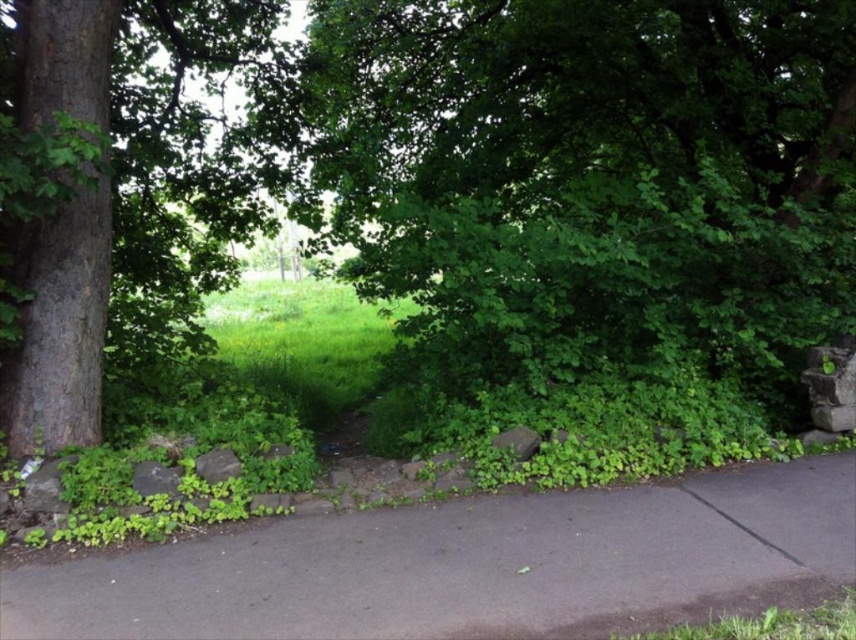
You are standing at point A, which is at coordinates point A at (547,253). You want to walk to point B, which is at coordinates point B at 0.602, 0.359. The path between them is 5.01 meters long. Can you walk directly from point A to point B without any obstacles?

The path between point A at (547,253) and point B at 0.602, 0.359 is 5.01 meters long. Since the scene description mentions a paved pathway that curves gently to the right, bordered by a low stone wall, there are no obstacles mentioned that would block the direct path between the two points. Therefore, you can walk directly from point A to point B without any obstacles.

You are a gardener who needs to place a new decorative stone along the paved pathway. The stone must be placed between the gray asphalt pavement at center and the smooth brown tree trunk at left. Based on their positions, which object should the stone be closer to?

The gray asphalt pavement at center is positioned on the right side of the smooth brown tree trunk at left, so the stone should be placed closer to the gray asphalt pavement at center to be between them.

You are standing on the paved pathway bordered by the stone wall and want to walk towards the green leafy tree at center. Which direction should you turn to avoid the smooth brown tree trunk at left?

You should turn to the right because the green leafy tree at center is positioned on the right side of the smooth brown tree trunk at left, so turning right will direct you away from the trunk and toward the tree.